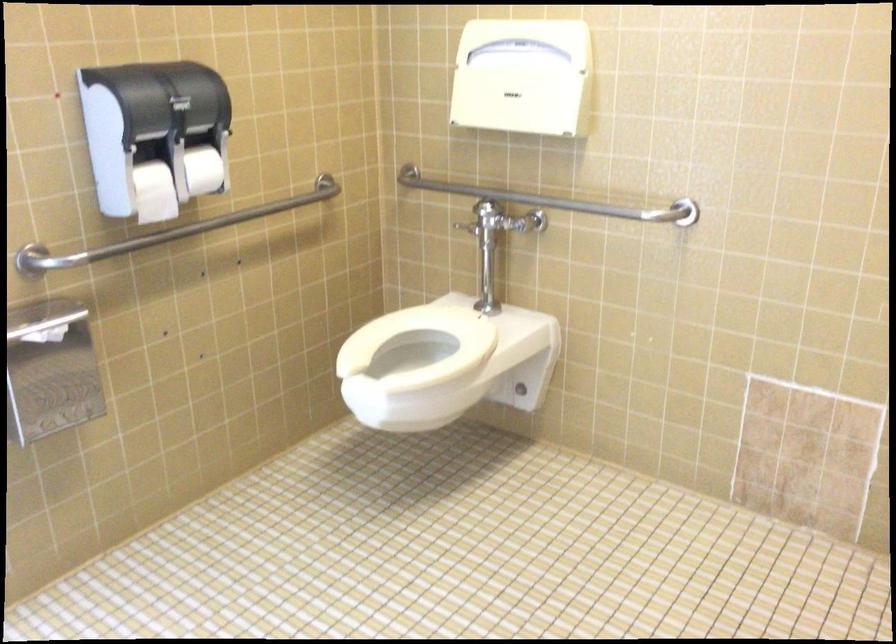
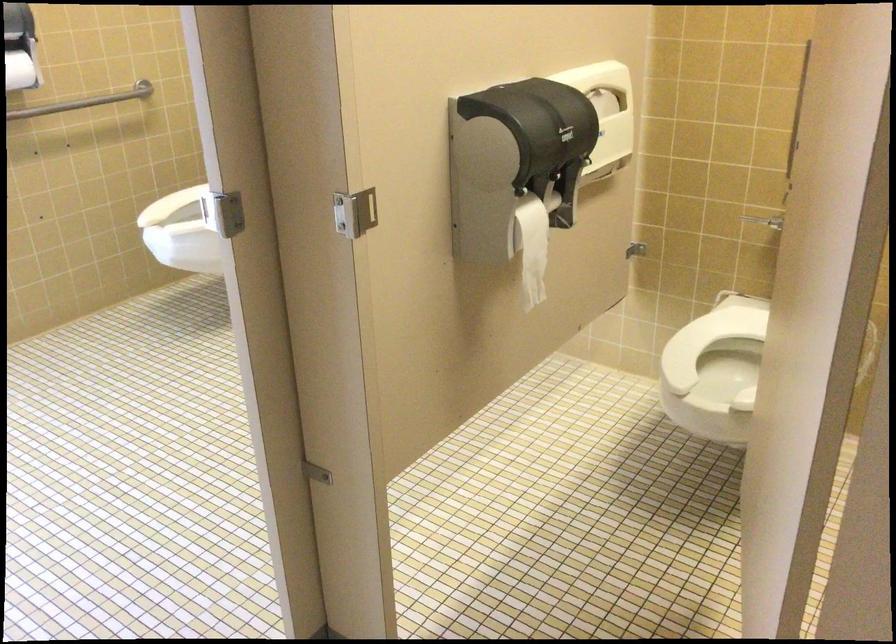
In the second image, find the point that corresponds to [252,201] in the first image.

(83, 102)